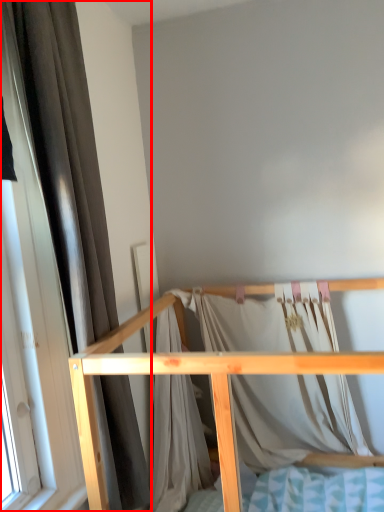
Question: Observing the image, what is the correct spatial positioning of curtain (annotated by the red box) in reference to furniture?

Choices:
 (A) right
 (B) left

Answer: (B)